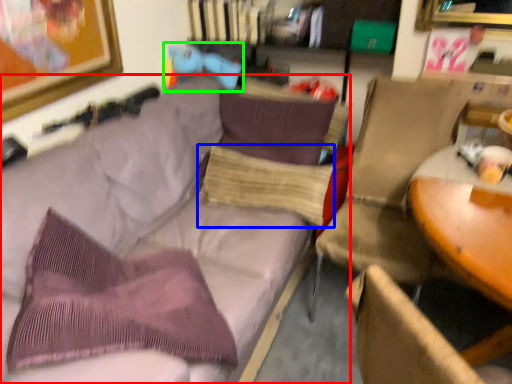
Question: Which is nearer to the studio couch (highlighted by a red box)? pillow (highlighted by a blue box) or toy (highlighted by a green box).

Choices:
 (A) pillow
 (B) toy

Answer: (A)